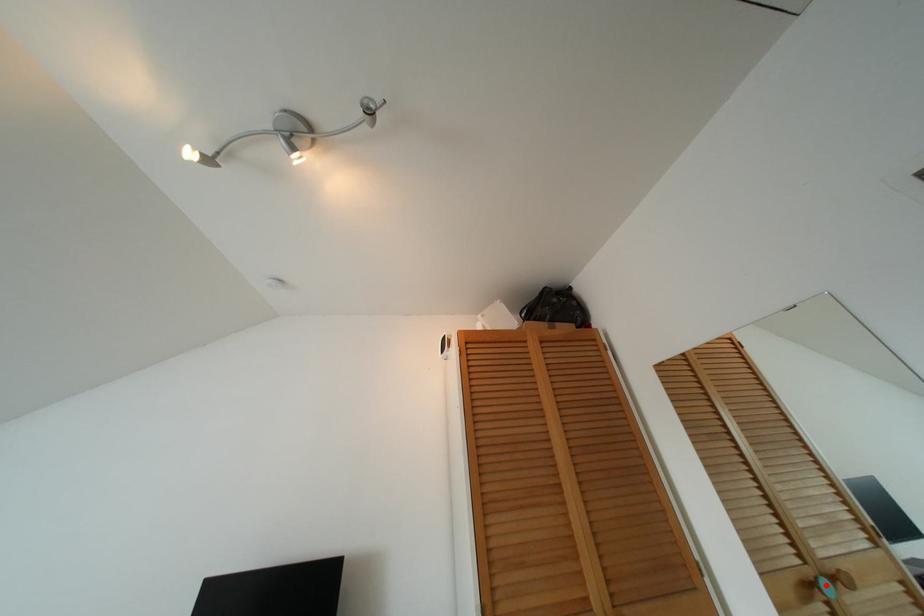
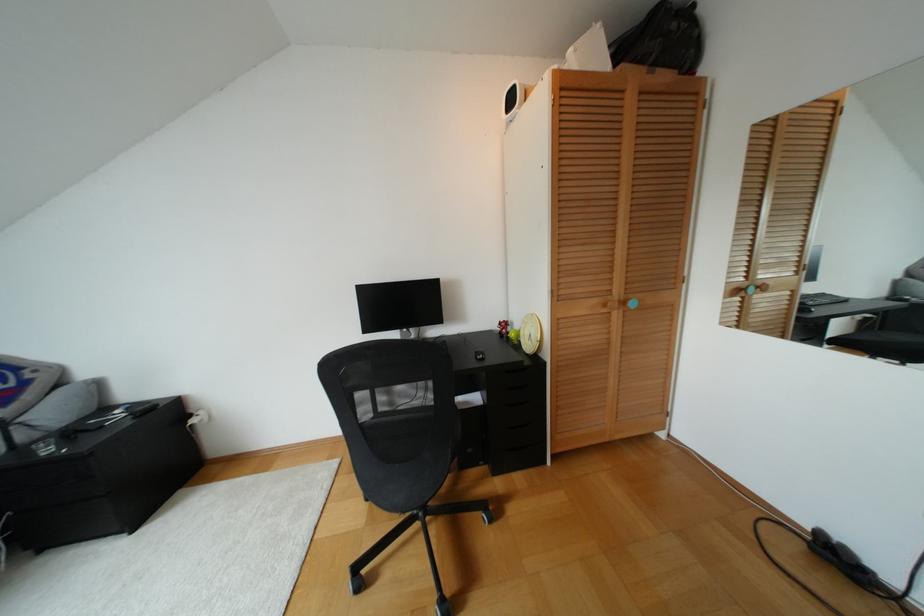
Question: I am providing you with two images of the same scene from different viewpoints. In image1, a red point is highlighted. Considering the same 3D point in image2, which of the following is correct?

Choices:
 (A) It is closer
 (B) It is farther

Answer: (B)